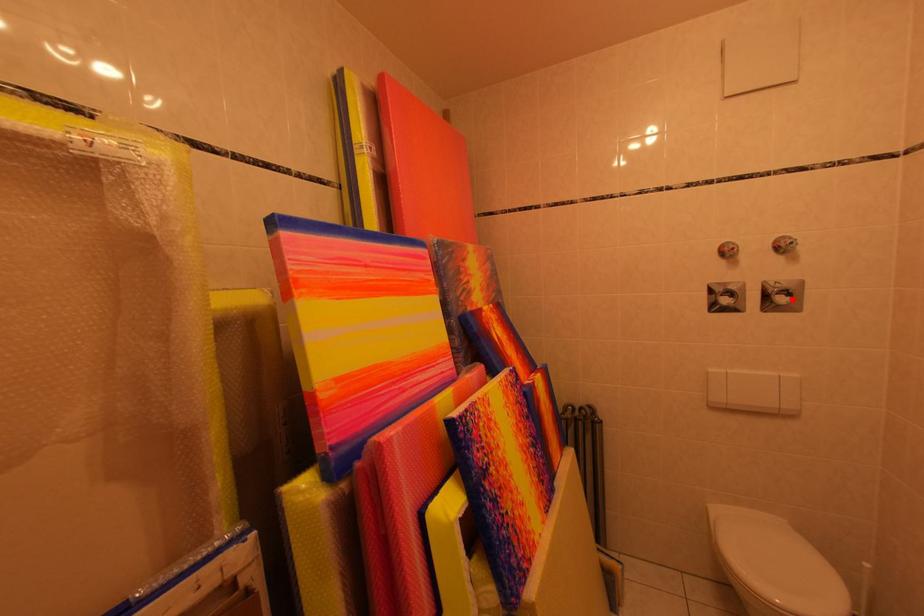
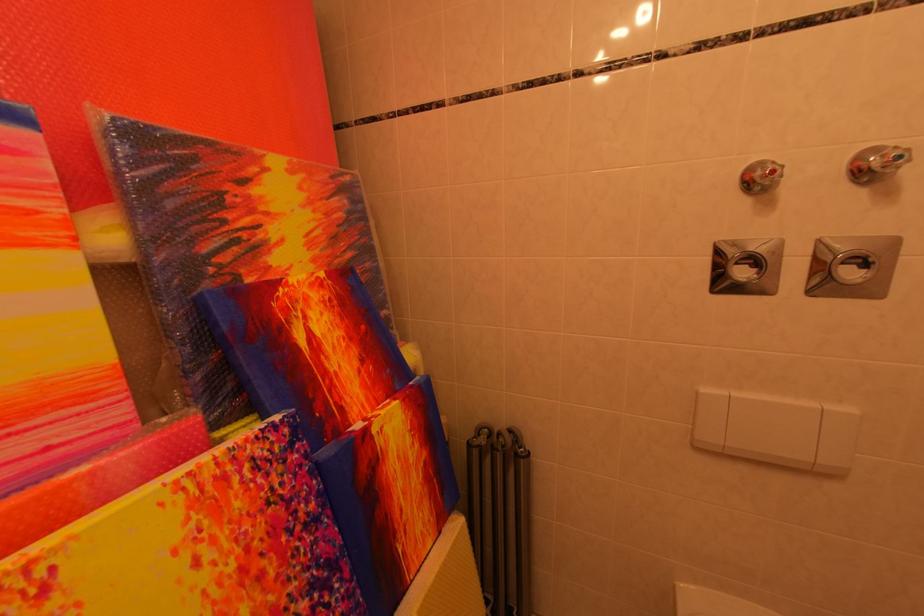
Where in the second image is the point corresponding to the highlighted location from the first image?

(864, 270)